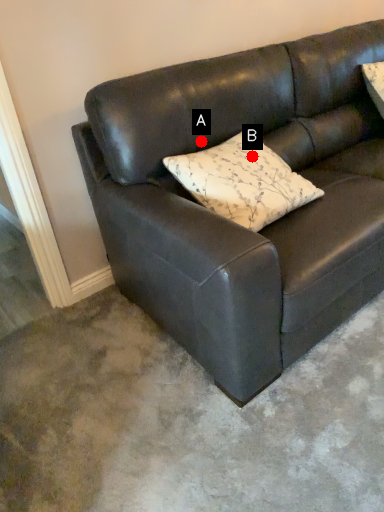
Question: Two points are circled on the image, labeled by A and B beside each circle. Which point appears closest to the camera in this image?

Choices:
 (A) A is closer
 (B) B is closer

Answer: (B)